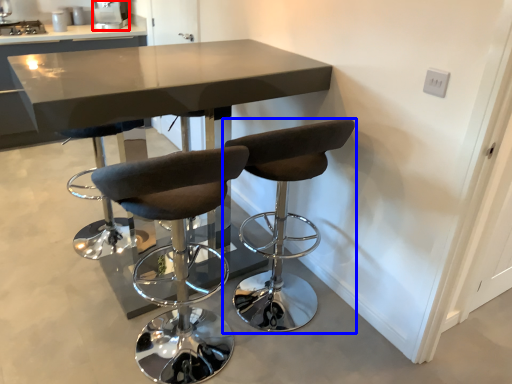
Question: Which point is further to the camera, appliance (highlighted by a red box) or chair (highlighted by a blue box)?

Choices:
 (A) appliance
 (B) chair

Answer: (A)